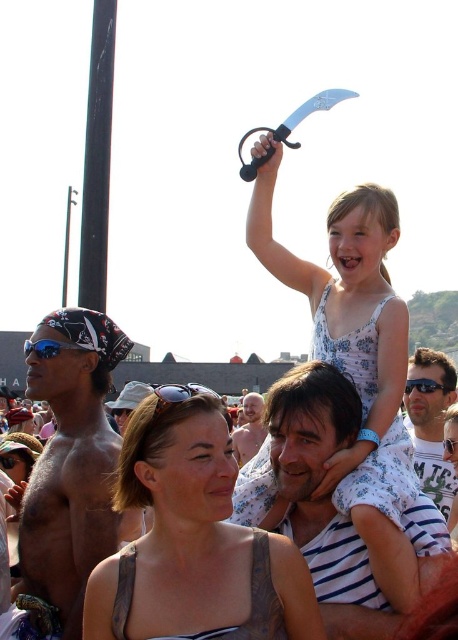
Question: Which object is the closest to the bald head at center?

Choices:
 (A) shiny metallic bandana at left
 (B) black plastic sunglasses at center

Answer: (B)

Question: Considering the real-world distances, which object is farthest from the black plastic sunglasses at upper center?

Choices:
 (A) shiny metallic bandana at left
 (B) blue reflective lens at left
 (C) matte black tank top at center
 (D) bald head at center

Answer: (B)

Question: Does matte white shirt at center have a larger size compared to black plastic sunglasses at center?

Choices:
 (A) yes
 (B) no

Answer: (B)

Question: Considering the real-world distances, which object is farthest from the black plastic sunglasses at center?

Choices:
 (A) matte white shirt at center
 (B) blue reflective lens at left

Answer: (A)

Question: Is shiny metallic bandana at left closer to camera compared to matte white shirt at center?

Choices:
 (A) yes
 (B) no

Answer: (A)

Question: Is matte black tank top at center further to camera compared to shiny metallic bandana at left?

Choices:
 (A) no
 (B) yes

Answer: (A)